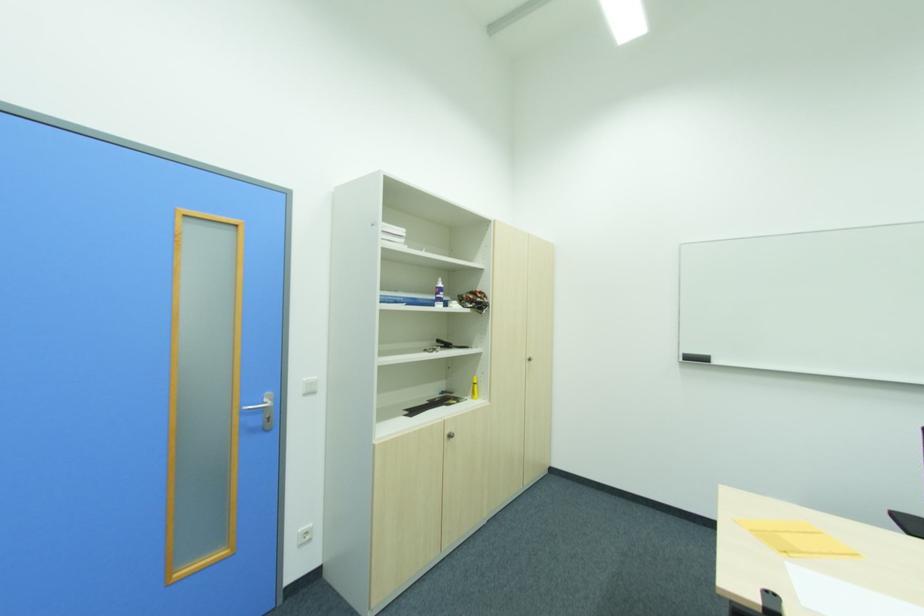
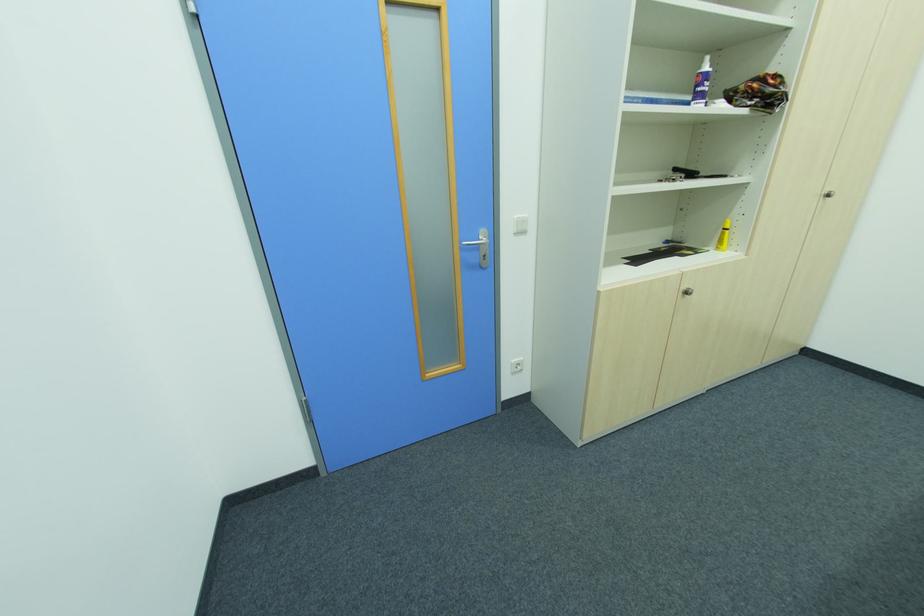
In the second image, find the point that corresponds to the point at 478,384 in the first image.

(728, 230)